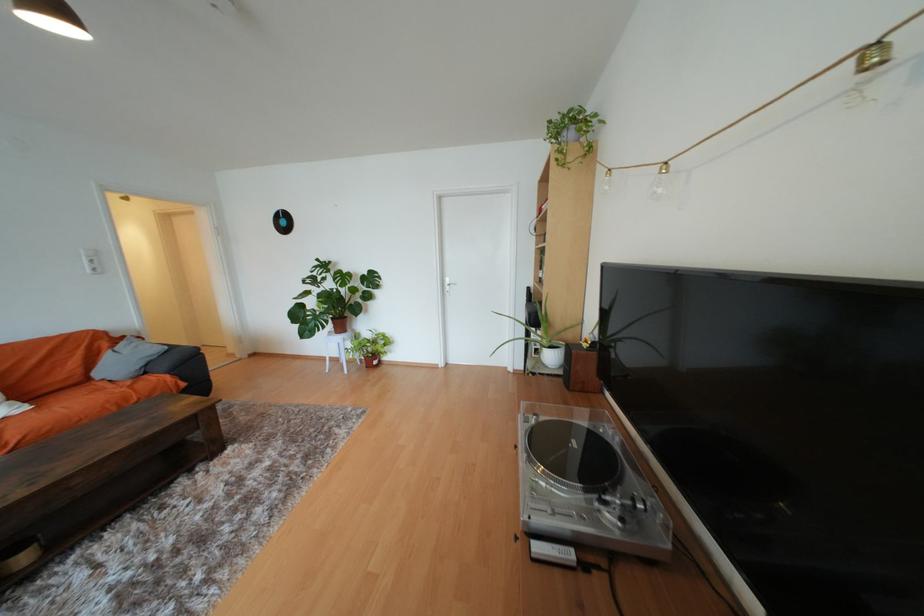
Which object does [371,347] point to?

This point indicates the brown plant pot.